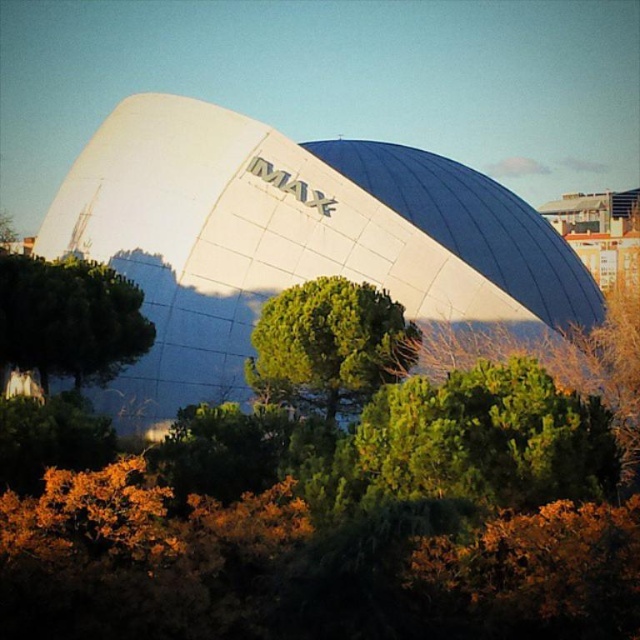
Is green leafy tree at center bigger than green leafy tree at left?

Incorrect, green leafy tree at center is not larger than green leafy tree at left.

Looking at this image, who is more forward, (280,317) or (54,374)?

Positioned in front is point (280,317).

Is point (268, 337) positioned after point (150, 333)?

That is False.

Where is `green leafy tree at center`? The width and height of the screenshot is (640, 640). green leafy tree at center is located at coordinates (328, 346).